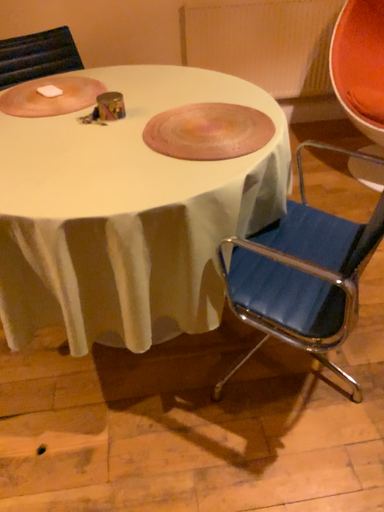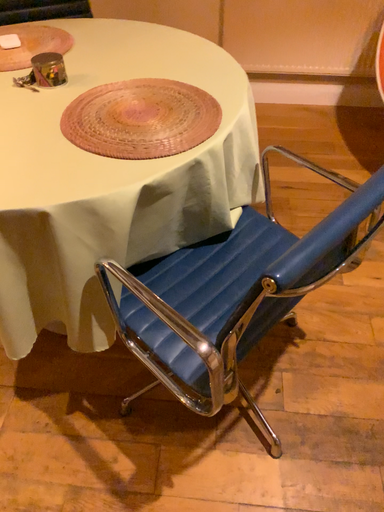
Question: Which way did the camera rotate in the video?

Choices:
 (A) rotated right
 (B) rotated left

Answer: (B)